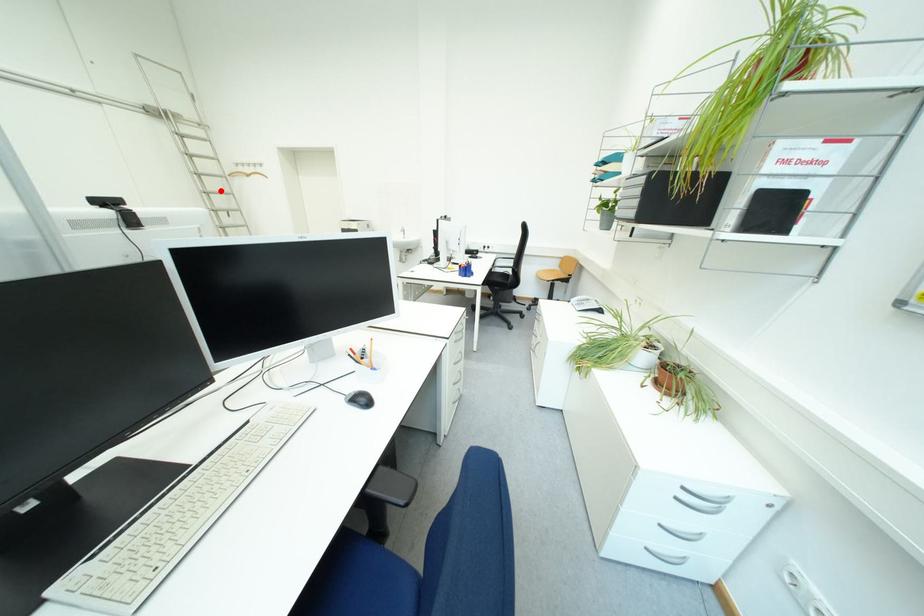
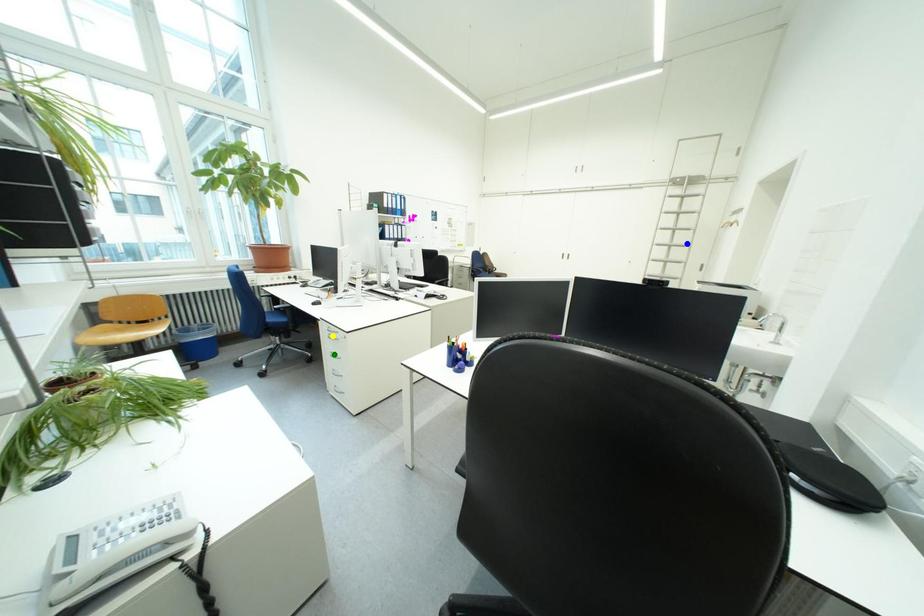
Question: I am providing you with two images of the same scene from different viewpoints. A red point is marked on the first image. You are given multiple points on the second image. Which point in image 2 represents the same 3d spot as the red point in image 1?

Choices:
 (A) yellow point
 (B) blue point
 (C) green point

Answer: (B)